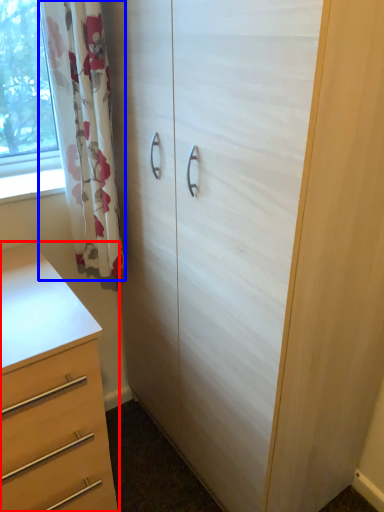
Question: Which of the following is the closest to the observer, chest of drawers (highlighted by a red box) or curtain (highlighted by a blue box)?

Choices:
 (A) chest of drawers
 (B) curtain

Answer: (A)